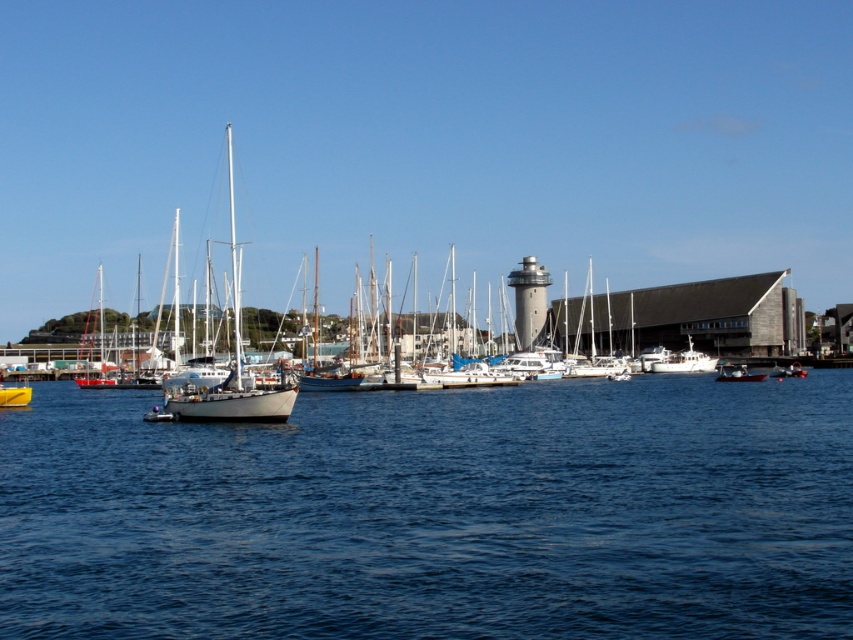
What is the exact coordinate of the blue water at center in the image?

The blue water at center is located at coordinate point (436, 513).

You are standing at the point marked by the coordinates point (737, 372) in the image. Which object are you on?

You are on the metallic silver boat at center.

You are a photographer planning to capture a shot of the metallic silver boat at center and the yellow matte boat at center. Based on their positions, which boat should you focus on first to ensure both are in frame without moving the camera?

The metallic silver boat at center is above the yellow matte boat at center, so you should focus on the yellow matte boat at center first to ensure both are in frame without moving the camera.